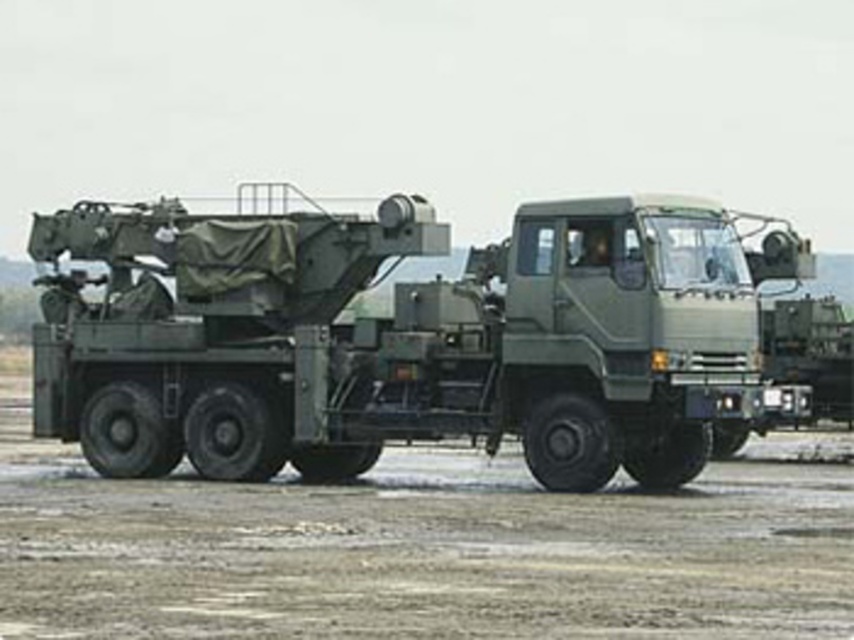
Is matte green truck at center closer to camera compared to dirt field at center?

That is False.

Who is more distant from viewer, (161,392) or (740,512)?

The point (161,392) is behind.

This screenshot has height=640, width=854. I want to click on matte green truck at center, so point(402,337).